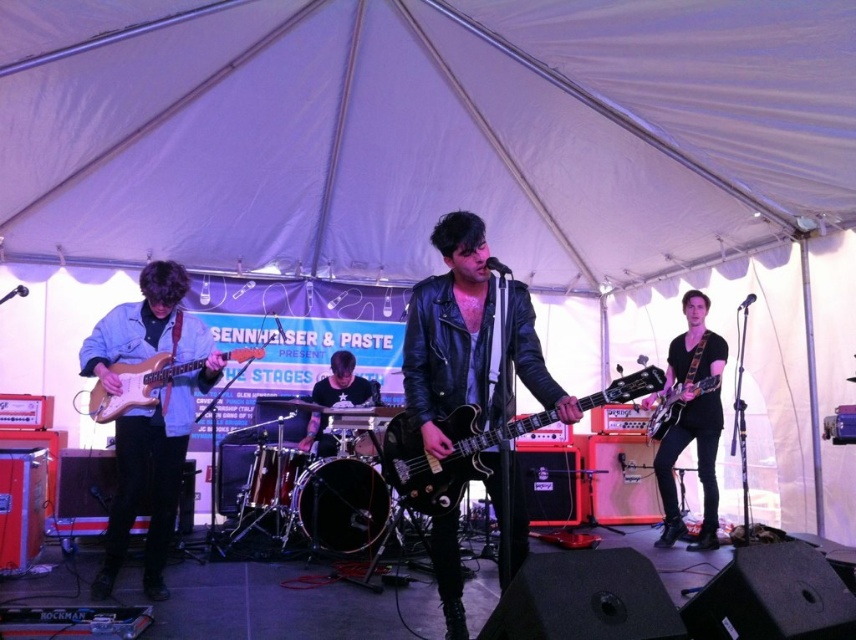
You are a photographer trying to capture the best angle of the performance. You have two points marked in your viewfinder at coordinates point (408, 396) and point (333, 364). Which point is closer to you?

Point (408, 396) is closer to the viewer than point (333, 364).